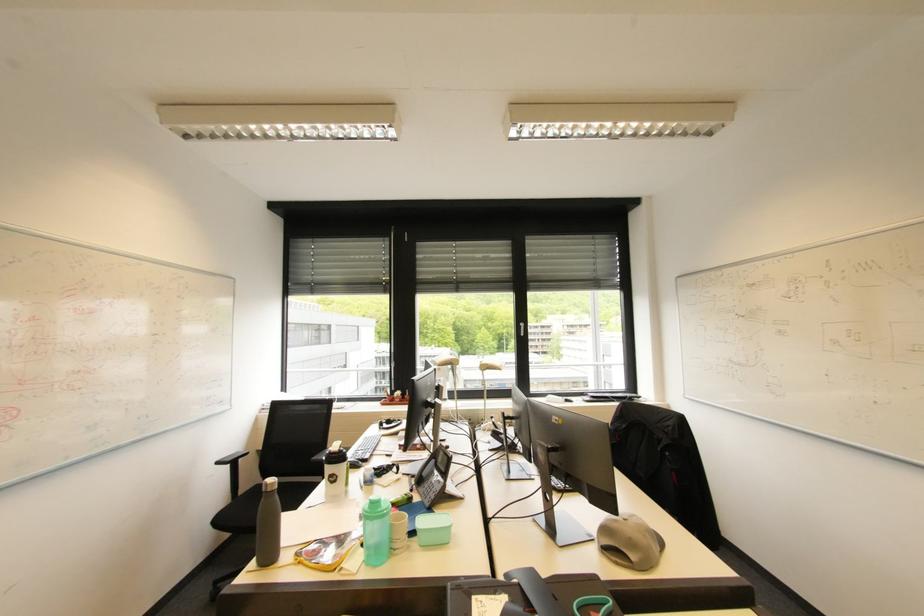
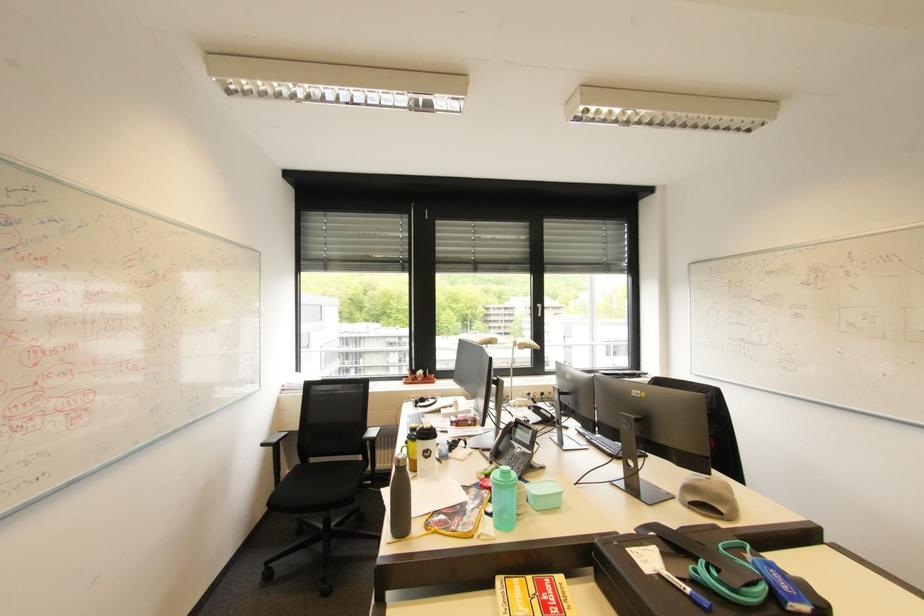
Where in the second image is the point corresponding to pixel 319 459 from the first image?

(370, 438)